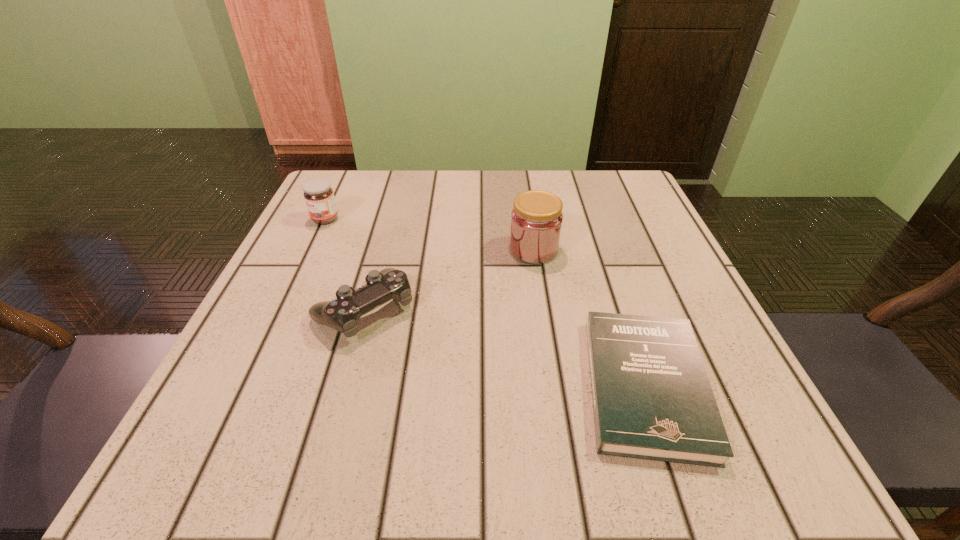
Image resolution: width=960 pixels, height=540 pixels. I want to click on free spot between the book and the farthest object, so click(x=486, y=302).

The width and height of the screenshot is (960, 540). I want to click on free space between the control and the third nearest object, so click(x=449, y=280).

Identify the location of unoccupied area between the farther jam and the book. (486, 302).

Locate an element on the screen. vacant area between the leftmost object and the control is located at coordinates (345, 265).

The width and height of the screenshot is (960, 540). In order to click on free space between the nearer jam and the shorter jam in this screenshot , I will do `click(429, 234)`.

You are a GUI agent. You are given a task and a screenshot of the screen. Output one action in this format:
    pyautogui.click(x=<x>, y=<y>)
    Task: Click on the object that is the third closest to the book
    Image resolution: width=960 pixels, height=540 pixels.
    Given the screenshot: What is the action you would take?
    coord(319,197)

Locate an element on the screen. object that is the closest to the tallest object is located at coordinates (652, 399).

Image resolution: width=960 pixels, height=540 pixels. I want to click on free space in the image that satisfies the following two spatial constraints: 1. on the back side of the taller jam; 2. on the right side of the third object from right to left, so click(x=381, y=249).

Locate an element on the screen. This screenshot has height=540, width=960. blank space that satisfies the following two spatial constraints: 1. on the front side of the leftmost object; 2. on the left side of the right jam is located at coordinates (311, 249).

The height and width of the screenshot is (540, 960). I want to click on vacant space that satisfies the following two spatial constraints: 1. on the front side of the shorter jam; 2. on the left side of the shortest object, so click(x=247, y=386).